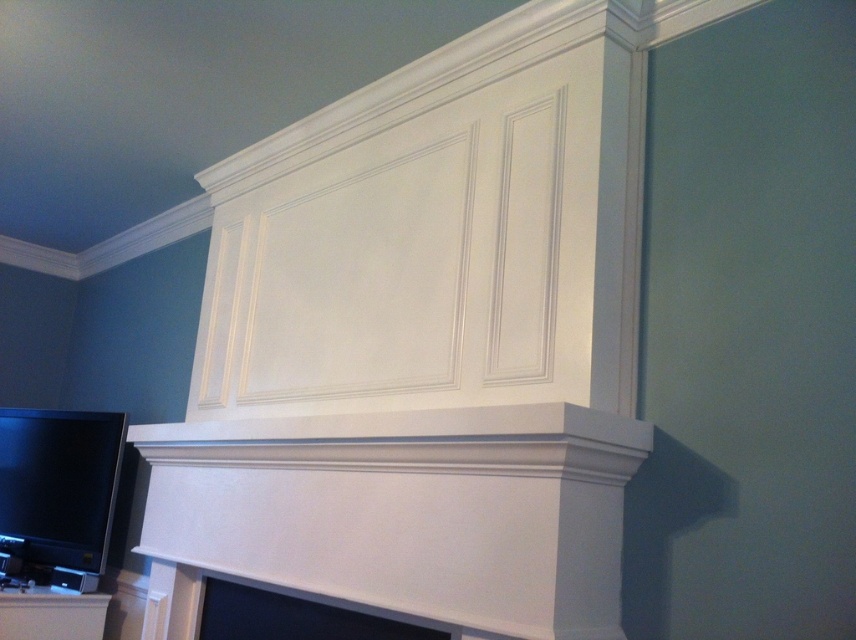
Can you confirm if matte black flat screen tv at lower left is thinner than matte white fireplace at lower center?

Indeed, matte black flat screen tv at lower left has a lesser width compared to matte white fireplace at lower center.

Does point (43, 497) lie in front of point (229, 632)?

No, (43, 497) is behind (229, 632).

Locate an element on the screen. Image resolution: width=856 pixels, height=640 pixels. matte black flat screen tv at lower left is located at coordinates (58, 484).